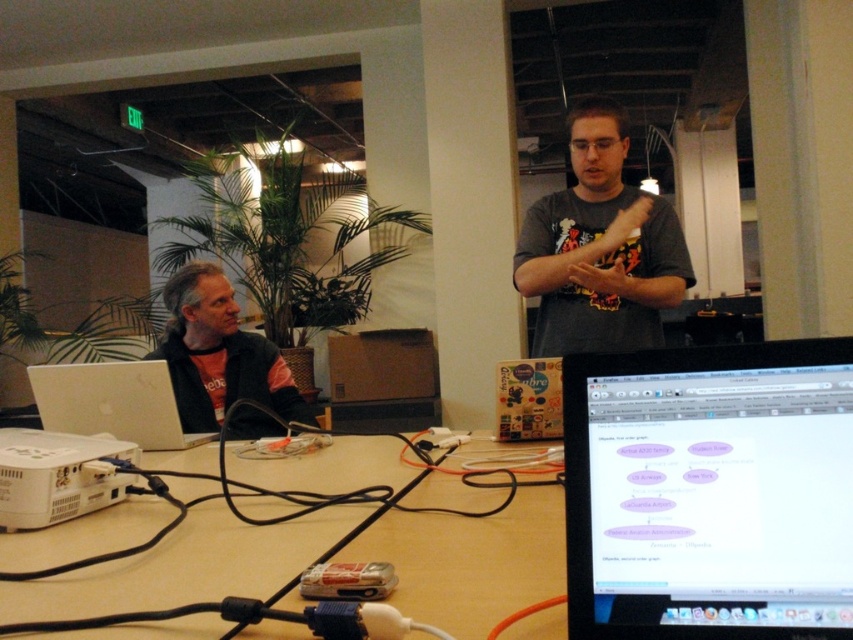
Question: Which point appears closest to the camera in this image?

Choices:
 (A) (526, 545)
 (B) (570, 240)
 (C) (94, 432)
 (D) (260, 403)

Answer: (A)

Question: Can you confirm if wooden table at center is positioned above matte black jacket at left?

Choices:
 (A) no
 (B) yes

Answer: (A)

Question: Can you confirm if matte black jacket at left is smaller than silver metallic laptop at left?

Choices:
 (A) yes
 (B) no

Answer: (B)

Question: Is gray matte t-shirt at center positioned before matte black jacket at left?

Choices:
 (A) yes
 (B) no

Answer: (B)

Question: Among these points, which one is nearest to the camera?

Choices:
 (A) (570, 566)
 (B) (276, 545)

Answer: (A)

Question: Which of the following is the farthest from the observer?

Choices:
 (A) (811, 387)
 (B) (637, 330)
 (C) (192, 385)

Answer: (C)